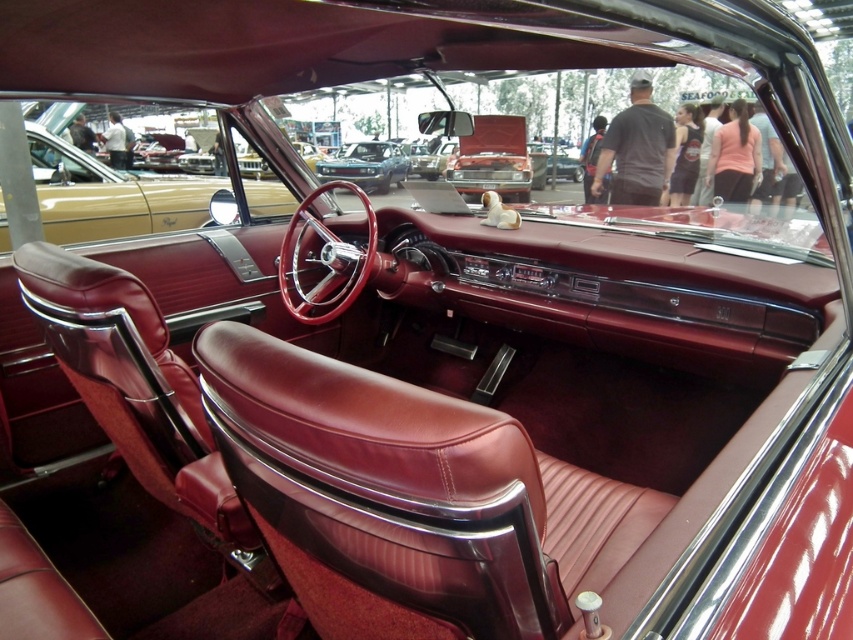
You are a mechanic inspecting the interior of a classic car. You notice the maroon leather steering wheel at center and the metallic blue car at center. Which object is shorter in height?

The maroon leather steering wheel at center has a lesser height compared to the metallic blue car at center, so the maroon leather steering wheel at center is shorter in height.

You are a mechanic inspecting the interior of a classic car. You notice the maroon leather steering wheel at center and the metallic blue car at center. Which object is positioned lower in the car?

The maroon leather steering wheel at center is positioned below the metallic blue car at center, so it is lower in the car.

You are sitting in the driver seat of the car and want to reach the maroon leather steering wheel at center. Where should you look to find it?

The maroon leather steering wheel at center is located at the center of the car, specifically at the coordinates point (109, 195), so you should look straight ahead to reach it.